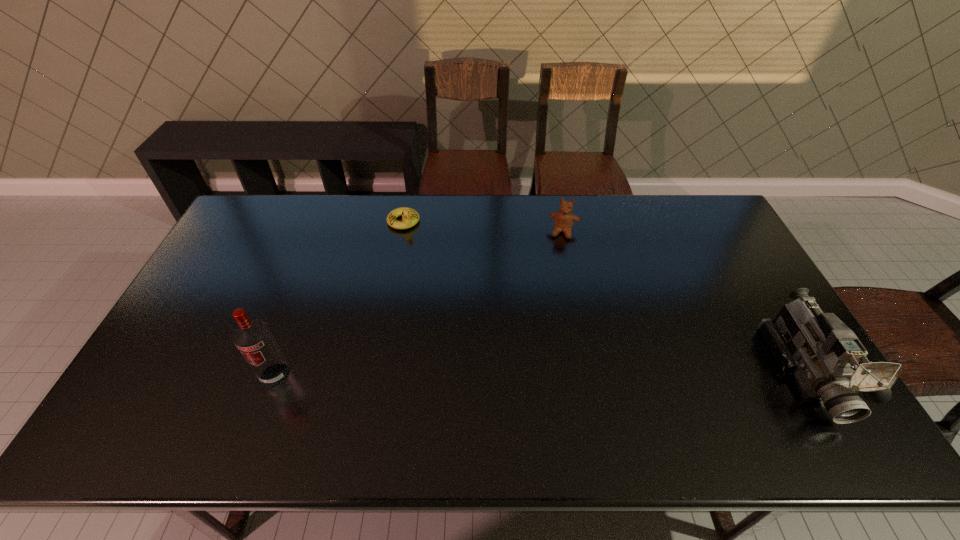
Where is `free space that satisfies the following two spatial constraints: 1. on the front side of the shortest object; 2. on the right side of the second shortest object`? The height and width of the screenshot is (540, 960). free space that satisfies the following two spatial constraints: 1. on the front side of the shortest object; 2. on the right side of the second shortest object is located at coordinates (401, 232).